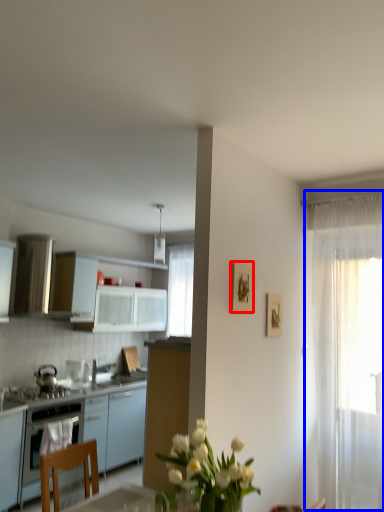
Question: Which point is closer to the camera, picture frame (highlighted by a red box) or curtain (highlighted by a blue box)?

Choices:
 (A) picture frame
 (B) curtain

Answer: (A)